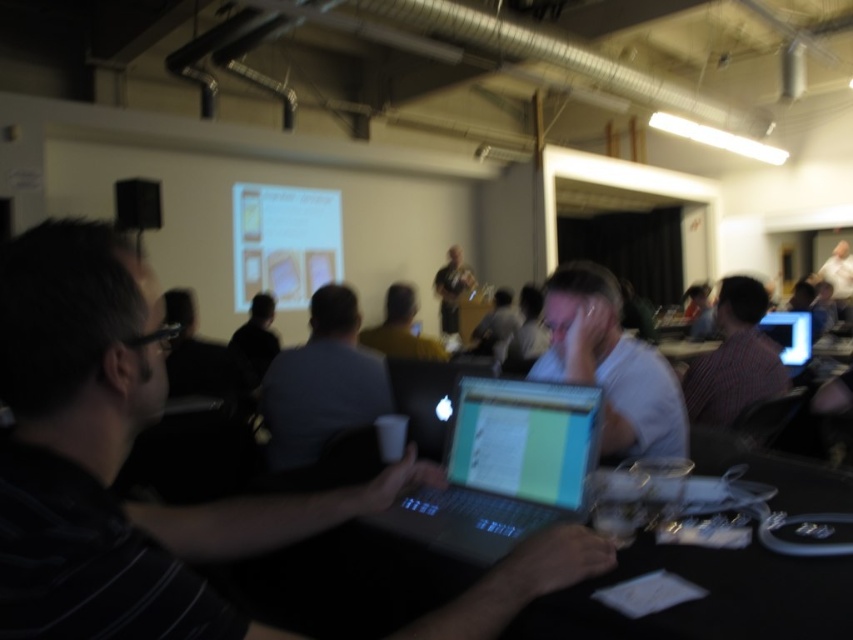
Question: Estimate the real-world distances between objects in this image. Which object is closer to the blue fabric shirt at center?

Choices:
 (A) striped shirt at right
 (B) black matte shirt at center

Answer: (A)

Question: Does yellow matte shirt at center lie behind blue glossy screen at upper center?

Choices:
 (A) no
 (B) yes

Answer: (A)

Question: Can you confirm if black matte laptop at center is wider than blue fabric shirt at center?

Choices:
 (A) yes
 (B) no

Answer: (A)

Question: Among these points, which one is nearest to the camera?

Choices:
 (A) (439, 294)
 (B) (444, 545)

Answer: (B)

Question: Can you confirm if matte white projector screen at upper center is smaller than black matte shirt at center?

Choices:
 (A) yes
 (B) no

Answer: (B)

Question: Which object appears closest to the camera in this image?

Choices:
 (A) black matte shirt at center
 (B) striped shirt at right
 (C) matte gray shirt at center

Answer: (B)